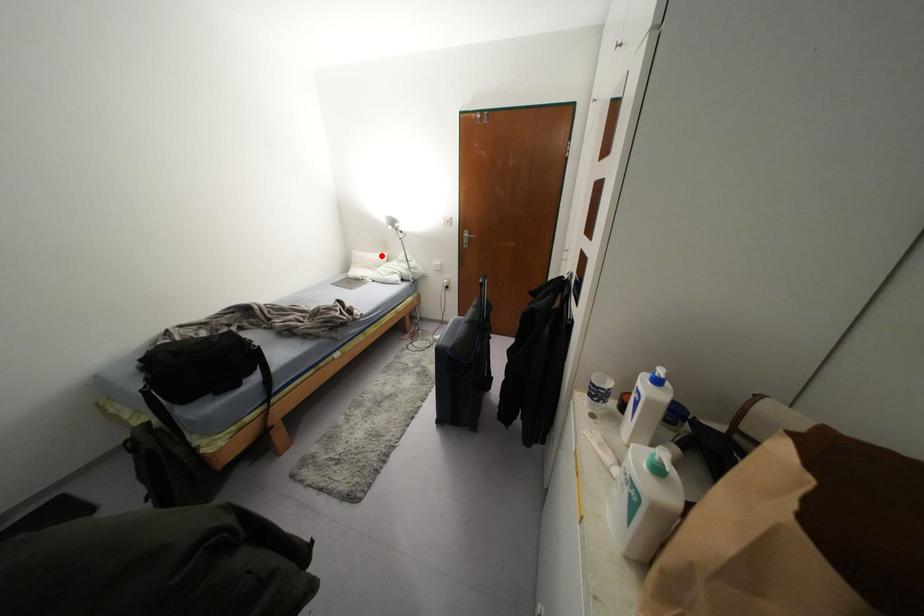
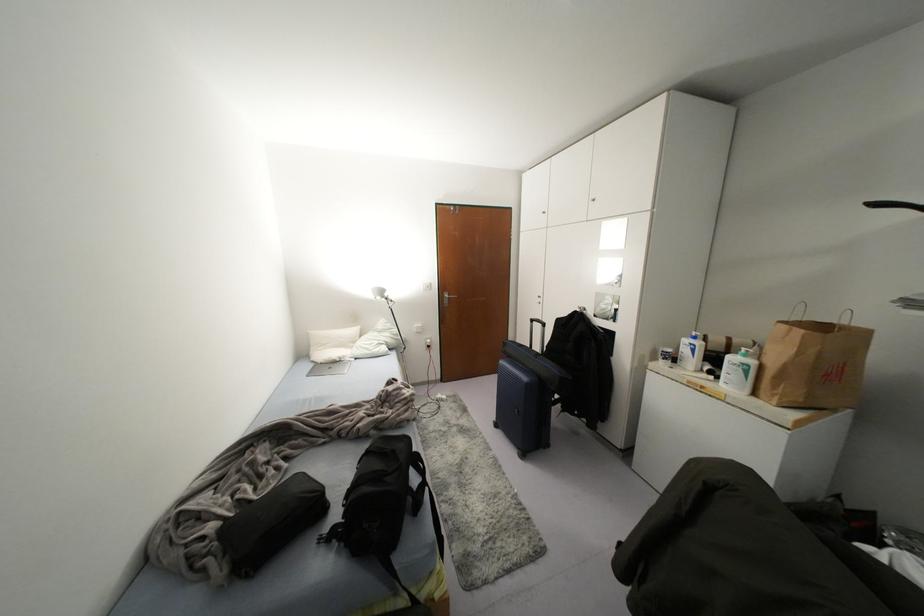
Locate, in the second image, the point that corresponds to the highlighted location in the first image.

(354, 330)